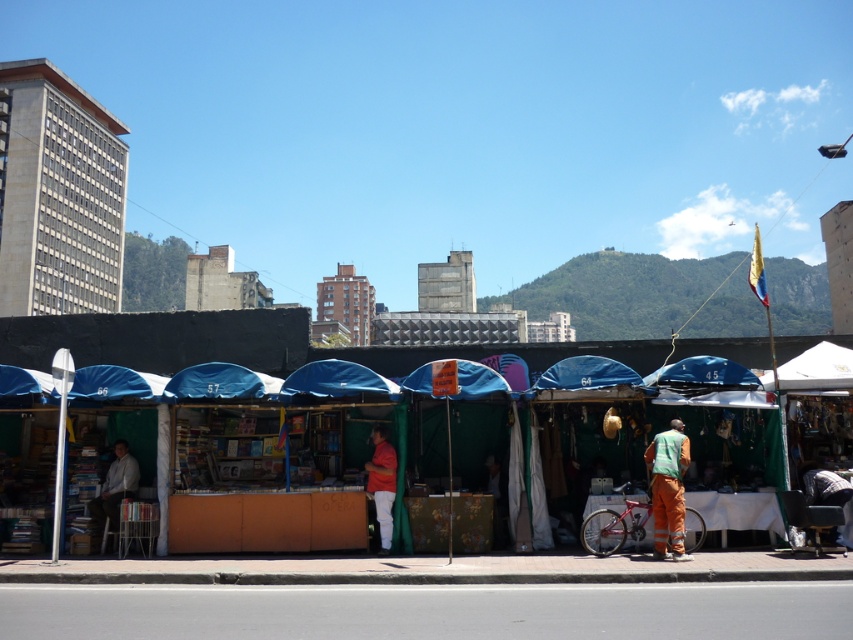
Question: Can you confirm if light gray shirt at left is wider than matte red shirt at center?

Choices:
 (A) no
 (B) yes

Answer: (B)

Question: Which object appears farthest from the camera in this image?

Choices:
 (A) blue fabric market stall at center
 (B) orange fabric street vendor at lower right
 (C) light gray shirt at left

Answer: (C)

Question: Which object appears closest to the camera in this image?

Choices:
 (A) blue fabric market stall at center
 (B) matte red shirt at center
 (C) orange fabric street vendor at lower right
 (D) light gray shirt at left

Answer: (C)

Question: Which of the following is the farthest from the observer?

Choices:
 (A) orange fabric street vendor at lower right
 (B) light gray shirt at left
 (C) blue fabric market stall at center

Answer: (B)

Question: Does orange fabric street vendor at lower right come behind matte red shirt at center?

Choices:
 (A) yes
 (B) no

Answer: (B)

Question: Does orange fabric street vendor at lower right appear on the right side of matte red shirt at center?

Choices:
 (A) yes
 (B) no

Answer: (A)